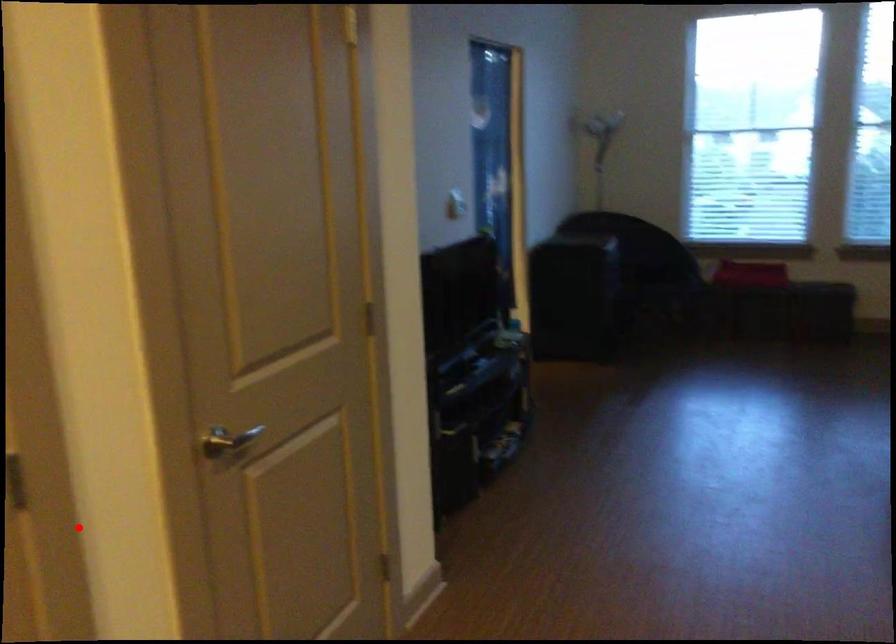
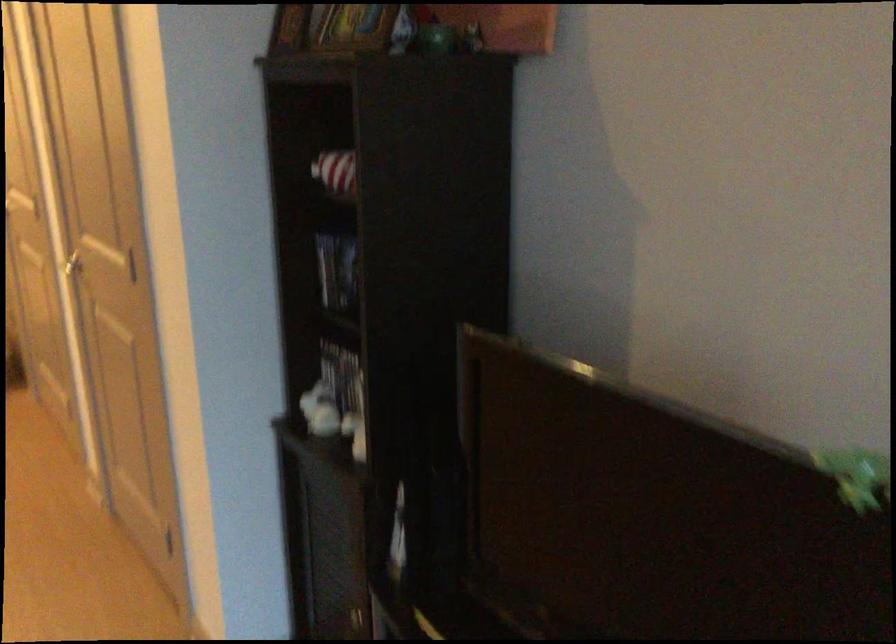
Find the pixel in the second image that matches the highlighted location in the first image.

(73, 267)